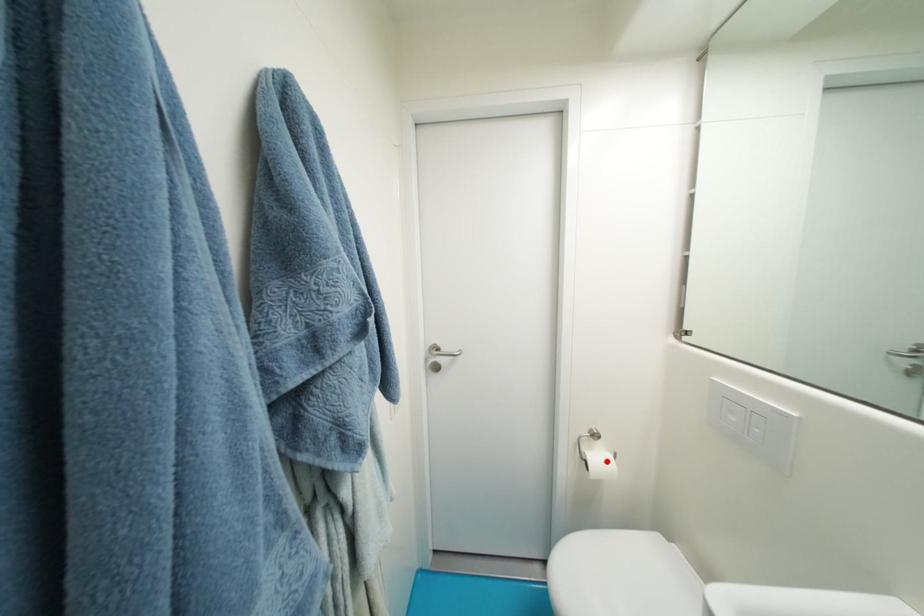
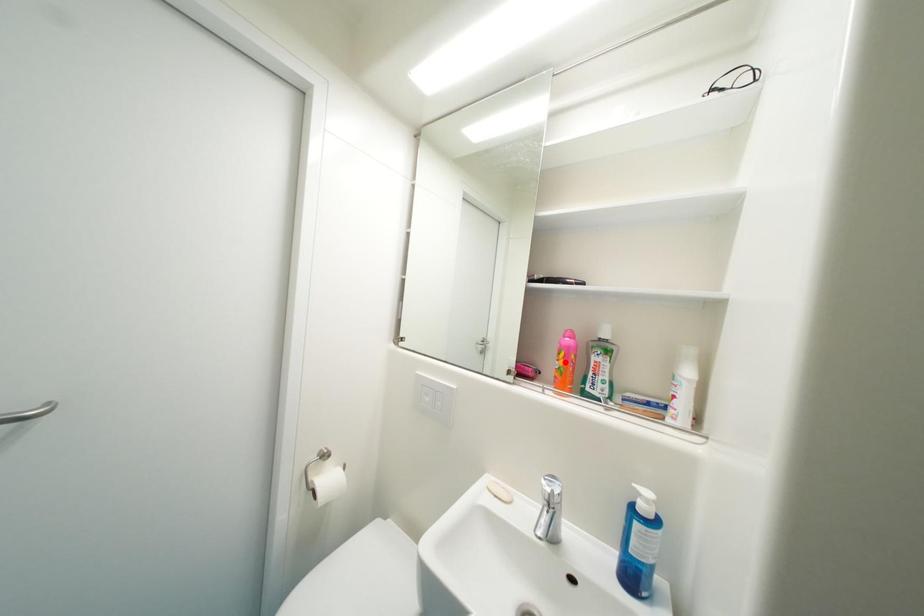
I am providing you with two images of the same scene from different viewpoints. A red point is marked on the first image and another point is marked on the second image. Do the highlighted points in image1 and image2 indicate the same real-world spot?

No